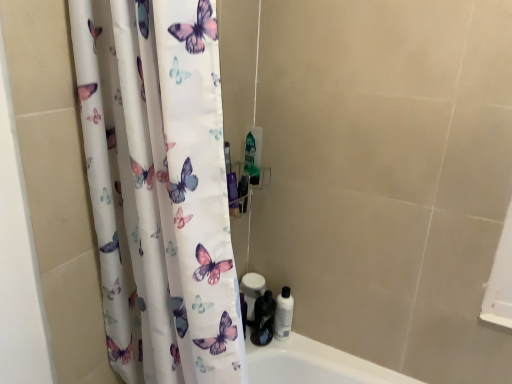
Question: From a real-world perspective, is shiny black bottle at lower right, the first toiletry viewed from the left, beneath white matte toilet paper at lower center?

Choices:
 (A) yes
 (B) no

Answer: (A)

Question: Considering the relative sizes of shiny black bottle at lower right, the first toiletry viewed from the left, and white matte toilet paper at lower center in the image provided, is shiny black bottle at lower right, the first toiletry viewed from the left, smaller than white matte toilet paper at lower center?

Choices:
 (A) no
 (B) yes

Answer: (B)

Question: Is shiny black bottle at lower right, the first toiletry viewed from the left, turned away from white matte toilet paper at lower center?

Choices:
 (A) yes
 (B) no

Answer: (B)

Question: Is shiny black bottle at lower right, the first toiletry viewed from the left, positioned before white matte toilet paper at lower center?

Choices:
 (A) yes
 (B) no

Answer: (A)

Question: Does shiny black bottle at lower right, positioned as the 2th toiletry in right-to-left order, have a greater height compared to white matte toilet paper at lower center?

Choices:
 (A) no
 (B) yes

Answer: (A)

Question: Would you say white glossy bottle at lower right, which is the 1th toiletry from right to left, is inside or outside shiny black bottle at lower right, the first toiletry viewed from the left?

Choices:
 (A) inside
 (B) outside

Answer: (B)

Question: In terms of width, does white glossy bottle at lower right, which is the 1th toiletry from right to left, look wider or thinner when compared to shiny black bottle at lower right, positioned as the 2th toiletry in right-to-left order?

Choices:
 (A) thin
 (B) wide

Answer: (A)

Question: From the image's perspective, is white glossy bottle at lower right, which ranks as the 2th toiletry in left-to-right order, above or below shiny black bottle at lower right, the first toiletry viewed from the left?

Choices:
 (A) below
 (B) above

Answer: (B)

Question: Would you say white glossy bottle at lower right, which is the 1th toiletry from right to left, is to the left or to the right of shiny black bottle at lower right, positioned as the 2th toiletry in right-to-left order, in the picture?

Choices:
 (A) left
 (B) right

Answer: (B)

Question: Is white glossy bottle at lower right, which ranks as the 2th toiletry in left-to-right order, wider or thinner than white matte toilet paper at lower center?

Choices:
 (A) wide
 (B) thin

Answer: (B)

Question: From the image's perspective, is white glossy bottle at lower right, which is the 1th toiletry from right to left, positioned above or below white matte toilet paper at lower center?

Choices:
 (A) above
 (B) below

Answer: (B)

Question: In terms of height, does white glossy bottle at lower right, which is the 1th toiletry from right to left, look taller or shorter compared to white matte toilet paper at lower center?

Choices:
 (A) short
 (B) tall

Answer: (A)

Question: Is white glossy bottle at lower right, which ranks as the 2th toiletry in left-to-right order, spatially inside white matte toilet paper at lower center, or outside of it?

Choices:
 (A) inside
 (B) outside

Answer: (B)

Question: From a real-world perspective, relative to white matte toilet paper at lower center, is shiny black bottle at lower right, positioned as the 2th toiletry in right-to-left order, vertically above or below?

Choices:
 (A) above
 (B) below

Answer: (B)

Question: Looking at their shapes, would you say shiny black bottle at lower right, the first toiletry viewed from the left, is wider or thinner than white matte toilet paper at lower center?

Choices:
 (A) wide
 (B) thin

Answer: (A)